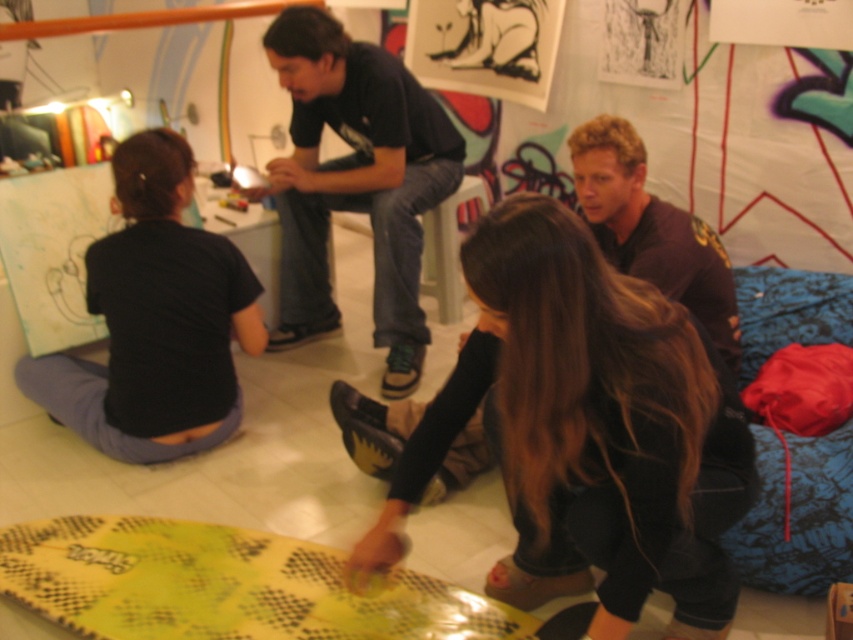
Is point (341, 609) closer to viewer compared to point (425, 168)?

Yes, point (341, 609) is in front of point (425, 168).

At what (x,y) coordinates should I click in order to perform the action: click on yellow textured surfboard at lower center. Please return your answer as a coordinate pair (x, y). The width and height of the screenshot is (853, 640). Looking at the image, I should click on click(225, 586).

Is point (178, 636) farther from camera compared to point (396, 307)?

No, it is not.

This screenshot has height=640, width=853. I want to click on yellow textured surfboard at lower center, so click(x=225, y=586).

In the scene shown: Is black matte shirt at lower left positioned before black cotton shirt at upper center?

Yes, black matte shirt at lower left is in front of black cotton shirt at upper center.

Between point (86, 394) and point (415, 173), which one is positioned behind?

The point (415, 173) is behind.

The width and height of the screenshot is (853, 640). What do you see at coordinates (155, 321) in the screenshot?
I see `black matte shirt at lower left` at bounding box center [155, 321].

Find the location of a particular element. This screenshot has width=853, height=640. black matte shirt at lower left is located at coordinates (155, 321).

Is smooth black pants at lower center shorter than yellow textured surfboard at lower center?

Incorrect, smooth black pants at lower center's height does not fall short of yellow textured surfboard at lower center's.

Describe the element at coordinates (585, 429) in the screenshot. This screenshot has width=853, height=640. I see `smooth black pants at lower center` at that location.

Which is in front, point (482, 339) or point (97, 548)?

Point (482, 339) is in front.

Identify the location of smooth black pants at lower center. (585, 429).